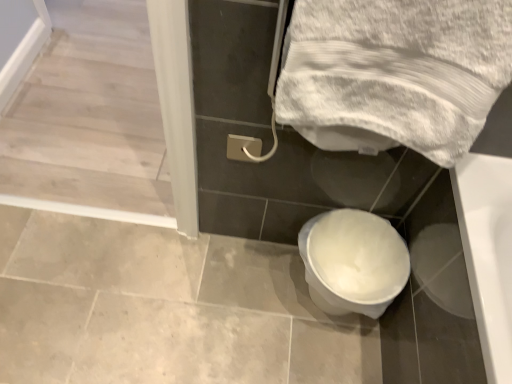
Question: Is white glossy toilet at lower center located outside white glossy screen door at upper left?

Choices:
 (A) no
 (B) yes

Answer: (B)

Question: Considering the relative sizes of white glossy toilet at lower center and white glossy screen door at upper left in the image provided, is white glossy toilet at lower center shorter than white glossy screen door at upper left?

Choices:
 (A) yes
 (B) no

Answer: (B)

Question: Does white glossy toilet at lower center have a larger size compared to white glossy screen door at upper left?

Choices:
 (A) yes
 (B) no

Answer: (B)

Question: Is white glossy toilet at lower center to the right of white glossy screen door at upper left from the viewer's perspective?

Choices:
 (A) no
 (B) yes

Answer: (B)

Question: Is white glossy toilet at lower center placed right next to white glossy screen door at upper left?

Choices:
 (A) no
 (B) yes

Answer: (A)

Question: From the image's perspective, is white textured towel at upper right positioned above or below white glossy toilet at lower center?

Choices:
 (A) below
 (B) above

Answer: (B)

Question: Is white textured towel at upper right wider or thinner than white glossy toilet at lower center?

Choices:
 (A) wide
 (B) thin

Answer: (B)

Question: In the image, is white textured towel at upper right positioned in front of or behind white glossy toilet at lower center?

Choices:
 (A) front
 (B) behind

Answer: (A)

Question: From their relative heights in the image, would you say white textured towel at upper right is taller or shorter than white glossy toilet at lower center?

Choices:
 (A) tall
 (B) short

Answer: (A)

Question: Is white textured towel at upper right in front of or behind white glossy screen door at upper left in the image?

Choices:
 (A) behind
 (B) front

Answer: (B)

Question: Considering the positions of white textured towel at upper right and white glossy screen door at upper left in the image, is white textured towel at upper right bigger or smaller than white glossy screen door at upper left?

Choices:
 (A) big
 (B) small

Answer: (B)

Question: Is point (380, 122) closer or farther from the camera than point (69, 97)?

Choices:
 (A) farther
 (B) closer

Answer: (B)

Question: Looking at their shapes, would you say white textured towel at upper right is wider or thinner than white glossy screen door at upper left?

Choices:
 (A) wide
 (B) thin

Answer: (B)

Question: Would you say white glossy screen door at upper left is to the left or to the right of white glossy toilet at lower center in the picture?

Choices:
 (A) right
 (B) left

Answer: (B)

Question: From a real-world perspective, is white glossy screen door at upper left physically located above or below white glossy toilet at lower center?

Choices:
 (A) below
 (B) above

Answer: (A)